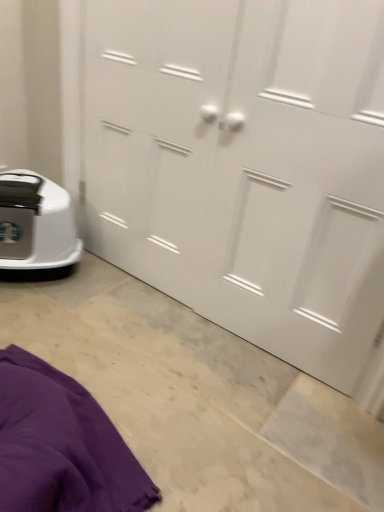
Question: Can you confirm if white matte door at center is positioned to the right of white plastic robot vacuum at lower left?

Choices:
 (A) no
 (B) yes

Answer: (B)

Question: Can you confirm if white matte door at center is thinner than white plastic robot vacuum at lower left?

Choices:
 (A) yes
 (B) no

Answer: (A)

Question: Does white matte door at center turn towards white plastic robot vacuum at lower left?

Choices:
 (A) yes
 (B) no

Answer: (A)

Question: Is white plastic robot vacuum at lower left located within white matte door at center?

Choices:
 (A) yes
 (B) no

Answer: (B)

Question: Considering the relative sizes of white matte door at center and white plastic robot vacuum at lower left in the image provided, is white matte door at center shorter than white plastic robot vacuum at lower left?

Choices:
 (A) no
 (B) yes

Answer: (A)

Question: From a real-world perspective, does white matte door at center stand above white plastic robot vacuum at lower left?

Choices:
 (A) no
 (B) yes

Answer: (B)

Question: Could white matte door at center be considered to be inside white plastic robot vacuum at lower left?

Choices:
 (A) no
 (B) yes

Answer: (A)

Question: From a real-world perspective, is white plastic robot vacuum at lower left positioned under white matte door at center based on gravity?

Choices:
 (A) yes
 (B) no

Answer: (A)

Question: Is white plastic robot vacuum at lower left to the left of white matte door at center from the viewer's perspective?

Choices:
 (A) yes
 (B) no

Answer: (A)

Question: Does white plastic robot vacuum at lower left turn towards white matte door at center?

Choices:
 (A) no
 (B) yes

Answer: (A)

Question: Is white plastic robot vacuum at lower left wider than white matte door at center?

Choices:
 (A) no
 (B) yes

Answer: (B)

Question: Is white plastic robot vacuum at lower left outside white matte door at center?

Choices:
 (A) yes
 (B) no

Answer: (A)

Question: Considering the relative sizes of white matte door at center and purple fabric at lower left in the image provided, is white matte door at center bigger than purple fabric at lower left?

Choices:
 (A) yes
 (B) no

Answer: (A)